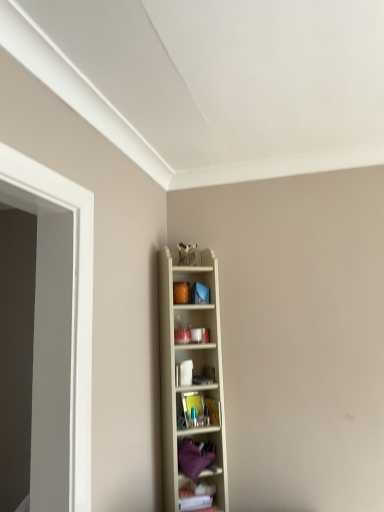
Question: Should I look upward or downward to see white plastic shelf at lower right, the 3th shelf positioned from the top?

Choices:
 (A) up
 (B) down

Answer: (B)

Question: Is wooden shelf at center, positioned as the first shelf in top-to-bottom order, a part of white plastic shelf at lower right, which is the 1th shelf in bottom-to-top order?

Choices:
 (A) yes
 (B) no

Answer: (B)

Question: From a real-world perspective, is white plastic shelf at lower right, the 3th shelf positioned from the top, beneath wooden shelf at center, which appears as the 3th shelf when ordered from the bottom?

Choices:
 (A) no
 (B) yes

Answer: (B)

Question: Is white plastic shelf at lower right, which is the 1th shelf in bottom-to-top order, to the left of wooden shelf at center, which appears as the 3th shelf when ordered from the bottom, from the viewer's perspective?

Choices:
 (A) no
 (B) yes

Answer: (A)

Question: Considering the relative sizes of white plastic shelf at lower right, the 3th shelf positioned from the top, and wooden shelf at center, positioned as the first shelf in top-to-bottom order, in the image provided, is white plastic shelf at lower right, the 3th shelf positioned from the top, smaller than wooden shelf at center, positioned as the first shelf in top-to-bottom order,?

Choices:
 (A) no
 (B) yes

Answer: (B)

Question: Is the position of white plastic shelf at lower right, the 3th shelf positioned from the top, less distant than that of wooden shelf at center, positioned as the first shelf in top-to-bottom order?

Choices:
 (A) yes
 (B) no

Answer: (B)

Question: From a real-world perspective, is white plastic shelf at lower right, the 3th shelf positioned from the top, over wooden shelf at center, which appears as the 3th shelf when ordered from the bottom?

Choices:
 (A) no
 (B) yes

Answer: (A)

Question: From a real-world perspective, is white plastic shelf at lower right, which is the 1th shelf in bottom-to-top order, on top of purple fabric at center, which appears as the 2th shelf when viewed from the top?

Choices:
 (A) no
 (B) yes

Answer: (A)

Question: Is white plastic shelf at lower right, the 3th shelf positioned from the top, next to purple fabric at center, which appears as the 2th shelf when viewed from the top?

Choices:
 (A) yes
 (B) no

Answer: (B)

Question: From the image's perspective, is white plastic shelf at lower right, which is the 1th shelf in bottom-to-top order, below purple fabric at center, marked as the second shelf in a bottom-to-top arrangement?

Choices:
 (A) yes
 (B) no

Answer: (A)

Question: Does white plastic shelf at lower right, which is the 1th shelf in bottom-to-top order, have a smaller size compared to purple fabric at center, marked as the second shelf in a bottom-to-top arrangement?

Choices:
 (A) yes
 (B) no

Answer: (A)

Question: Would you say purple fabric at center, marked as the second shelf in a bottom-to-top arrangement, is part of white plastic shelf at lower right, the 3th shelf positioned from the top,'s contents?

Choices:
 (A) yes
 (B) no

Answer: (B)

Question: Considering the relative positions of white plastic shelf at lower right, which is the 1th shelf in bottom-to-top order, and purple fabric at center, marked as the second shelf in a bottom-to-top arrangement, in the image provided, is white plastic shelf at lower right, which is the 1th shelf in bottom-to-top order, behind purple fabric at center, marked as the second shelf in a bottom-to-top arrangement,?

Choices:
 (A) yes
 (B) no

Answer: (A)

Question: From the image's perspective, would you say purple fabric at center, which appears as the 2th shelf when viewed from the top, is shown under wooden shelf at center, which appears as the 3th shelf when ordered from the bottom?

Choices:
 (A) yes
 (B) no

Answer: (A)